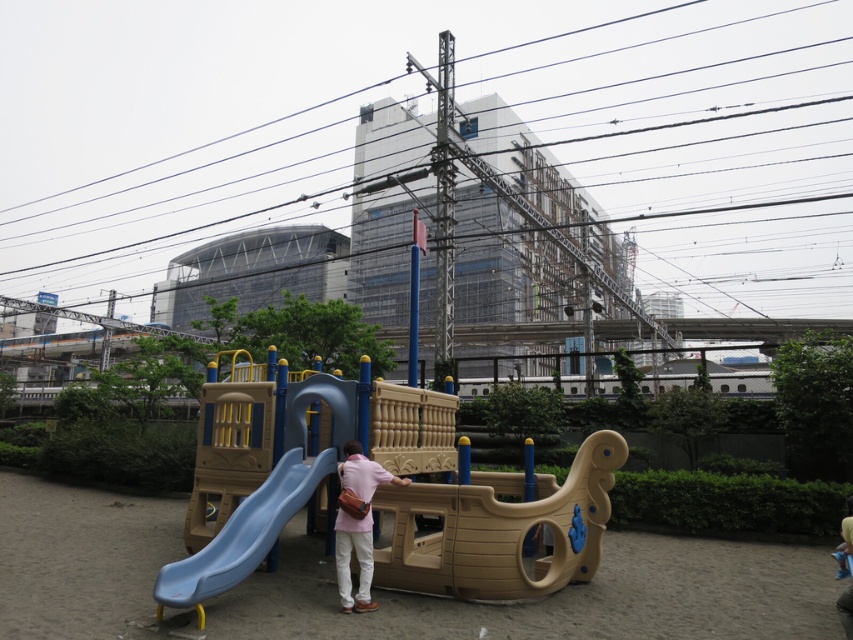
Can you confirm if black wire at upper center is bigger than blue plastic slide at lower left?

Correct, black wire at upper center is larger in size than blue plastic slide at lower left.

Which is behind, point (805, 44) or point (252, 552)?

Point (805, 44)

The height and width of the screenshot is (640, 853). What do you see at coordinates (331, 102) in the screenshot?
I see `black wire at upper center` at bounding box center [331, 102].

At what (x,y) coordinates should I click in order to perform the action: click on black wire at upper center. Please return your answer as a coordinate pair (x, y). The width and height of the screenshot is (853, 640). Looking at the image, I should click on (331, 102).